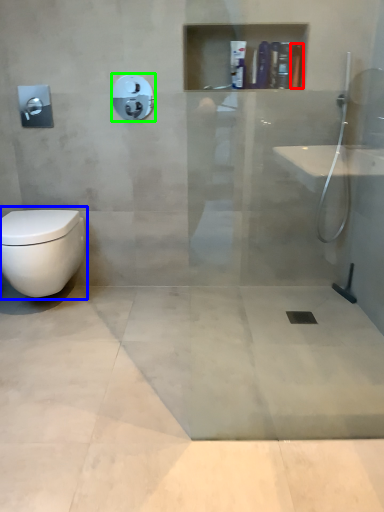
Question: Estimate the real-world distances between objects in this image. Which object is closer to toiletry (highlighted by a red box), toilet (highlighted by a blue box) or shower (highlighted by a green box)?

Choices:
 (A) toilet
 (B) shower

Answer: (B)